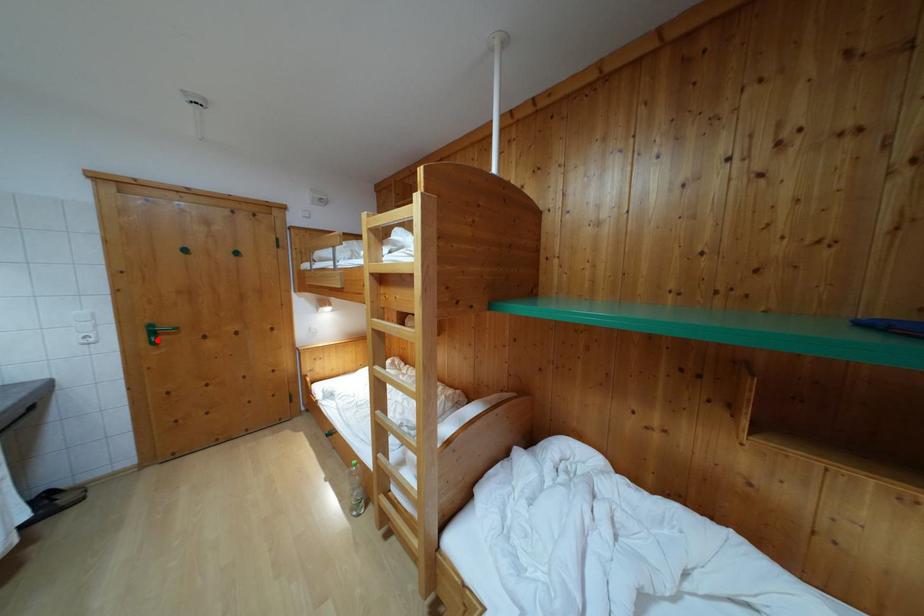
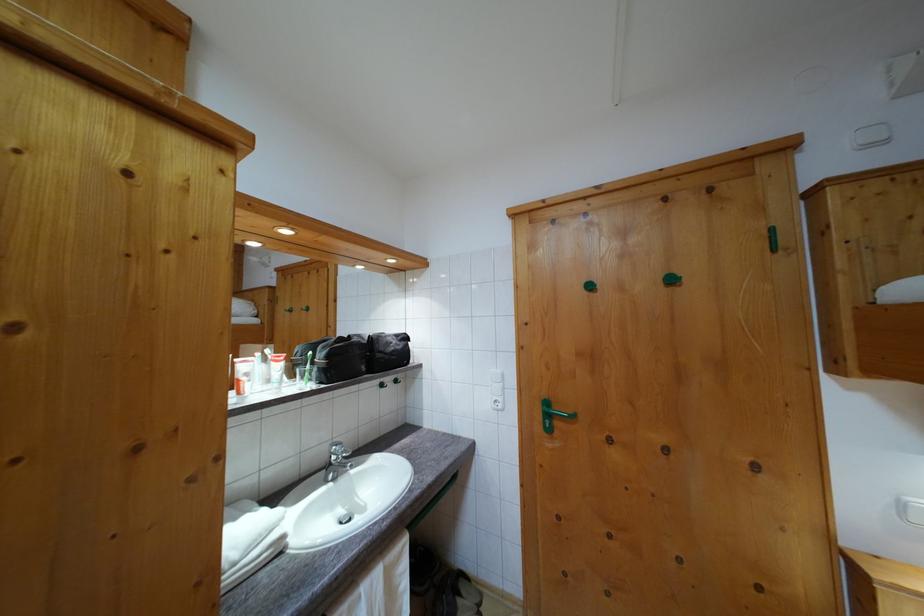
Where in the second image is the point corresponding to the highlighted location from the first image?

(552, 422)